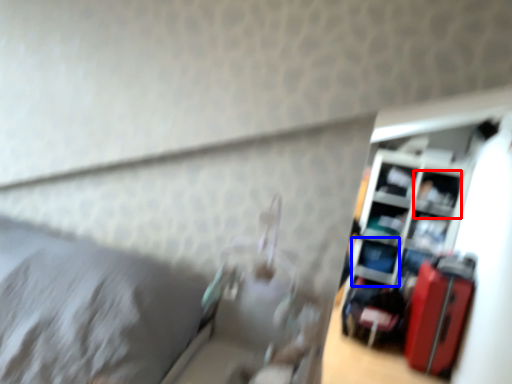
Question: Which object is closer to the camera taking this photo, shelf (highlighted by a red box) or shelf (highlighted by a blue box)?

Choices:
 (A) shelf
 (B) shelf

Answer: (A)